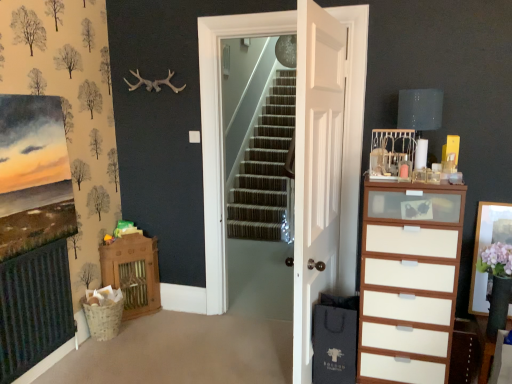
What do you see at coordinates (133, 273) in the screenshot? The height and width of the screenshot is (384, 512). I see `wooden cabinet at left` at bounding box center [133, 273].

Image resolution: width=512 pixels, height=384 pixels. Find the location of `white wooden door at center, the 2th door positioned from the front`. white wooden door at center, the 2th door positioned from the front is located at coordinates (221, 131).

Where is `white wood chest of drawers at right`? This screenshot has width=512, height=384. white wood chest of drawers at right is located at coordinates (408, 281).

Between white wooden door at center, the 2th door from the back, and wooden picture frame at right, which one has more height?

white wooden door at center, the 2th door from the back, is taller.

Between white wooden door at center, the 2th door from the back, and wooden picture frame at right, which one appears on the right side from the viewer's perspective?

wooden picture frame at right is more to the right.

Is white wooden door at center, the 2th door from the back, looking in the opposite direction of wooden picture frame at right?

That's not correct — white wooden door at center, the 2th door from the back, is not looking away from wooden picture frame at right.

From the image's perspective, is white wooden door at center, placed as the 1th door when sorted from front to back, below wooden picture frame at right?

No, from the image's perspective, white wooden door at center, placed as the 1th door when sorted from front to back, is not beneath wooden picture frame at right.

How much distance is there between white wooden door at center, positioned as the first door in back-to-front order, and wooden cabinet at left?

They are 28.07 inches apart.

Between white wooden door at center, the 2th door positioned from the front, and wooden cabinet at left, which one has larger size?

white wooden door at center, the 2th door positioned from the front.

From a real-world perspective, which is physically below, white wooden door at center, positioned as the first door in back-to-front order, or wooden cabinet at left?

wooden cabinet at left.

Considering the relative sizes of white wooden door at center, the 2th door positioned from the front, and wooden cabinet at left in the image provided, is white wooden door at center, the 2th door positioned from the front, thinner than wooden cabinet at left?

Indeed, white wooden door at center, the 2th door positioned from the front, has a lesser width compared to wooden cabinet at left.

Considering the relative sizes of white wooden door at center, the 2th door positioned from the front, and wooden picture frame at right in the image provided, is white wooden door at center, the 2th door positioned from the front, wider than wooden picture frame at right?

Indeed, white wooden door at center, the 2th door positioned from the front, has a greater width compared to wooden picture frame at right.

From a real-world perspective, is white wooden door at center, the 2th door positioned from the front, under wooden picture frame at right?

No.

Does white wooden door at center, the 2th door positioned from the front, touch wooden picture frame at right?

No, white wooden door at center, the 2th door positioned from the front, is not in contact with wooden picture frame at right.

Measure the distance between wooden picture frame at right and white wood chest of drawers at right.

27.00 inches.

Can you confirm if wooden picture frame at right is shorter than white wood chest of drawers at right?

Yes.

Locate an element on the screen. The image size is (512, 384). picture frame above the white wood chest of drawers at right (from the image's perspective) is located at coordinates (486, 247).

In the image, is wooden picture frame at right positioned in front of or behind white wood chest of drawers at right?

Clearly, wooden picture frame at right is behind white wood chest of drawers at right.

Between white wooden door at center, the 2th door from the back, and white wood chest of drawers at right, which one has smaller width?

white wooden door at center, the 2th door from the back.

Considering the points (334, 35) and (440, 319), which point is behind, point (334, 35) or point (440, 319)?

The point (334, 35) is behind.

This screenshot has width=512, height=384. I want to click on the chest of drawers lying below the white wooden door at center, placed as the 1th door when sorted from front to back (from the image's perspective), so point(408,281).

Is white wooden door at center, placed as the 1th door when sorted from front to back, looking in the opposite direction of white wood chest of drawers at right?

Absolutely, white wooden door at center, placed as the 1th door when sorted from front to back, is directed away from white wood chest of drawers at right.

Who is taller, wooden picture frame at right or white wooden door at center, the 2th door from the back?

white wooden door at center, the 2th door from the back.

You are a GUI agent. You are given a task and a screenshot of the screen. Output one action in this format:
    pyautogui.click(x=<x>, y=<y>)
    Task: Click on the picture frame below the white wooden door at center, the 2th door from the back (from the image's perspective)
    
    Given the screenshot: What is the action you would take?
    pyautogui.click(x=486, y=247)

Is wooden picture frame at right at the left side of white wooden door at center, placed as the 1th door when sorted from front to back?

No, wooden picture frame at right is not to the left of white wooden door at center, placed as the 1th door when sorted from front to back.

Is wooden picture frame at right thinner than wooden cabinet at left?

Yes.

Consider the image. Is wooden picture frame at right looking in the opposite direction of wooden cabinet at left?

wooden picture frame at right does not have its back to wooden cabinet at left.

Consider the image. Is wooden picture frame at right directly adjacent to wooden cabinet at left?

wooden picture frame at right and wooden cabinet at left are clearly separated.

From the image's perspective, is wooden picture frame at right located above or below wooden cabinet at left?

wooden picture frame at right is situated higher than wooden cabinet at left in the image.

Identify the location of picture frame on the right of white wooden door at center, the 2th door from the back. The height and width of the screenshot is (384, 512). (486, 247).

Find the location of a particular element. This screenshot has height=384, width=512. the 1st door in front when counting from the wooden cabinet at left is located at coordinates (221, 131).

Based on their spatial positions, is white wood chest of drawers at right or white wooden door at center, the 2th door from the back, closer to wooden cabinet at left?

Among the two, white wooden door at center, the 2th door from the back, is located nearer to wooden cabinet at left.

Looking at the image, which one is located closer to white wood chest of drawers at right, wooden cabinet at left or white wooden door at center, the 2th door positioned from the front?

The object closer to white wood chest of drawers at right is white wooden door at center, the 2th door positioned from the front.

Based on their spatial positions, is wooden cabinet at left or matte gray lampshade at upper right closer to white wood chest of drawers at right?

Based on the image, matte gray lampshade at upper right appears to be nearer to white wood chest of drawers at right.

Looking at the image, which one is located closer to white wooden door at center, placed as the 1th door when sorted from front to back, matte gray lampshade at upper right or wooden cabinet at left?

Based on the image, matte gray lampshade at upper right appears to be nearer to white wooden door at center, placed as the 1th door when sorted from front to back.

Considering their positions, is wooden picture frame at right positioned further to white wood chest of drawers at right than white wooden door at center, positioned as the first door in back-to-front order?

white wooden door at center, positioned as the first door in back-to-front order, is further to white wood chest of drawers at right.

Which object lies further to the anchor point matte gray lampshade at upper right, white wooden door at center, positioned as the first door in back-to-front order, or wooden picture frame at right?

Among the two, white wooden door at center, positioned as the first door in back-to-front order, is located further to matte gray lampshade at upper right.

Which object lies further to the anchor point white wooden door at center, the 2th door from the back, wooden cabinet at left or white wooden door at center, the 2th door positioned from the front?

Based on the image, wooden cabinet at left appears to be further to white wooden door at center, the 2th door from the back.

When comparing their distances from matte gray lampshade at upper right, does wooden picture frame at right or wooden cabinet at left seem closer?

wooden picture frame at right lies closer to matte gray lampshade at upper right than the other object.

Identify the location of door between white wooden door at center, the 2th door positioned from the front, and white wood chest of drawers at right from left to right. (316, 168).

Identify the location of picture frame between matte gray lampshade at upper right and white wood chest of drawers at right vertically. (486, 247).

Locate an element on the screen. chest of drawers between white wooden door at center, the 2th door positioned from the front, and matte gray lampshade at upper right from left to right is located at coordinates (408, 281).

Locate an element on the screen. Image resolution: width=512 pixels, height=384 pixels. chest of drawers between wooden cabinet at left and wooden picture frame at right in the horizontal direction is located at coordinates (408, 281).